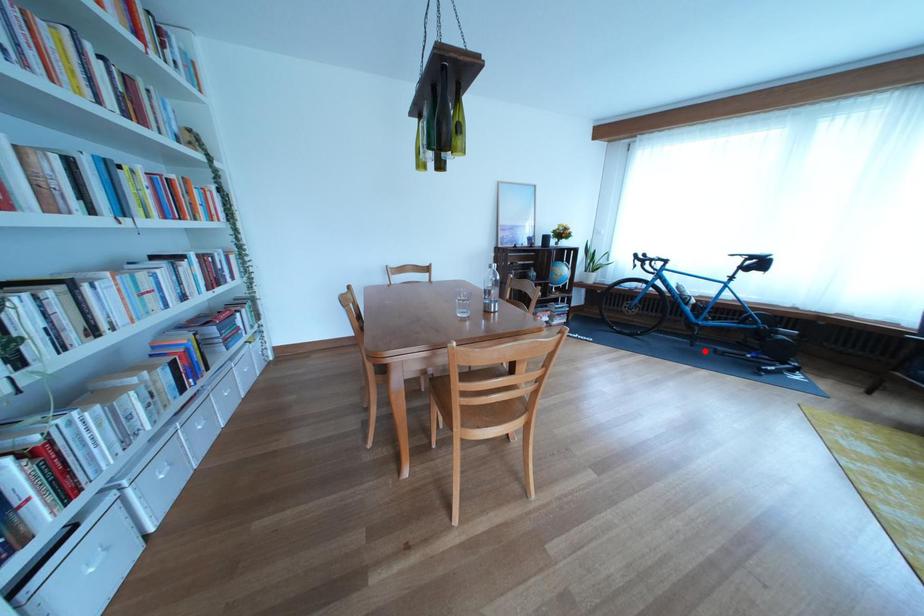
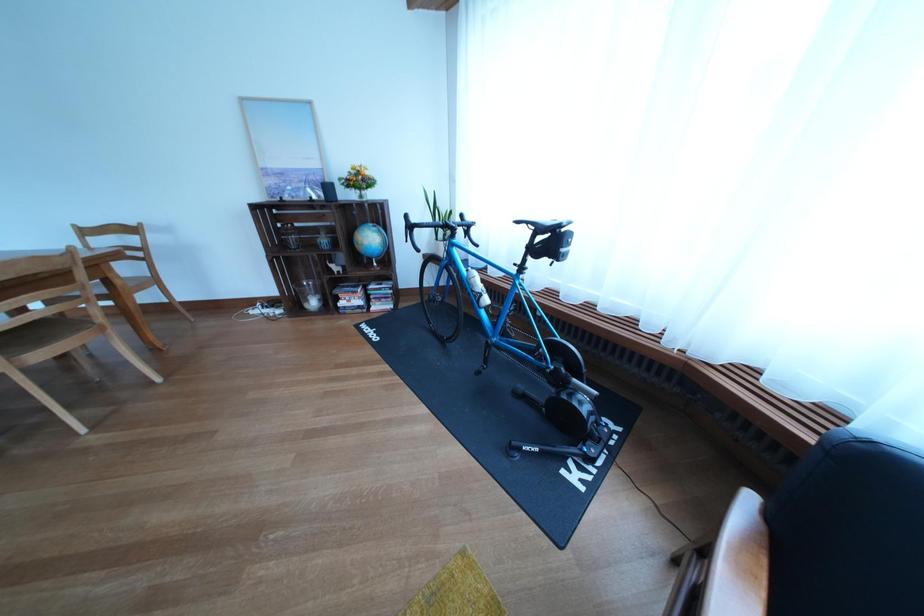
Locate, in the second image, the point that corresponds to the highlighted location in the first image.

(492, 379)